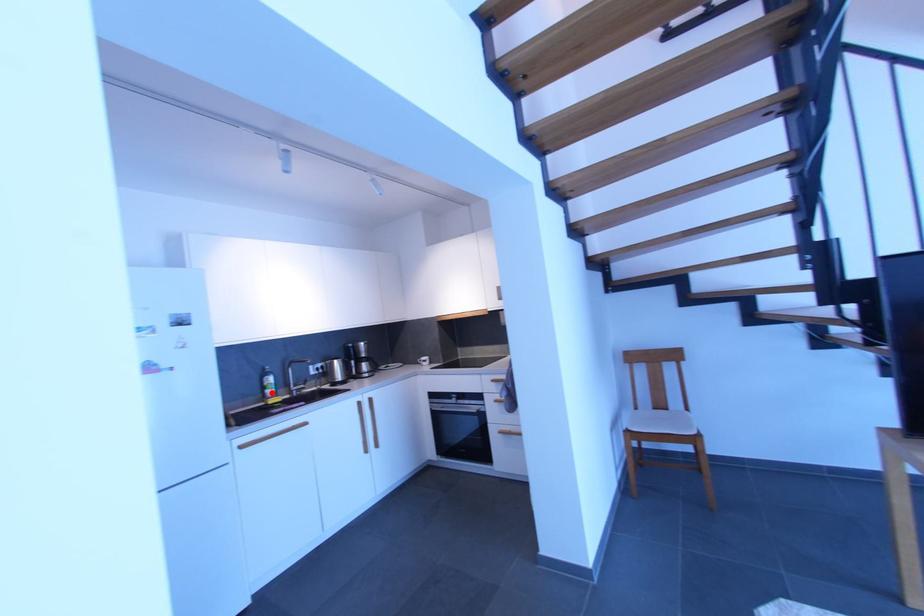
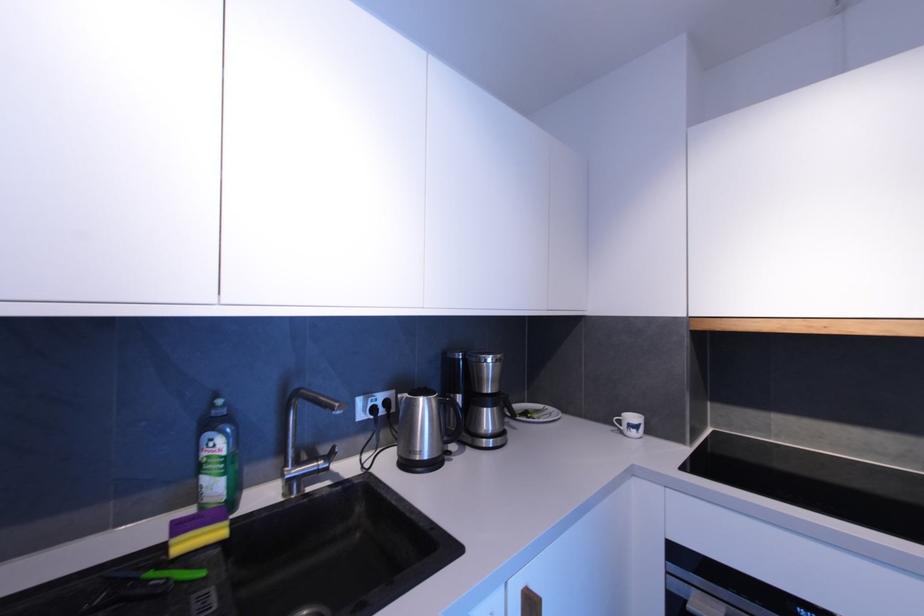
In the second image, find the point that corresponds to the highlighted location in the first image.

(210, 482)